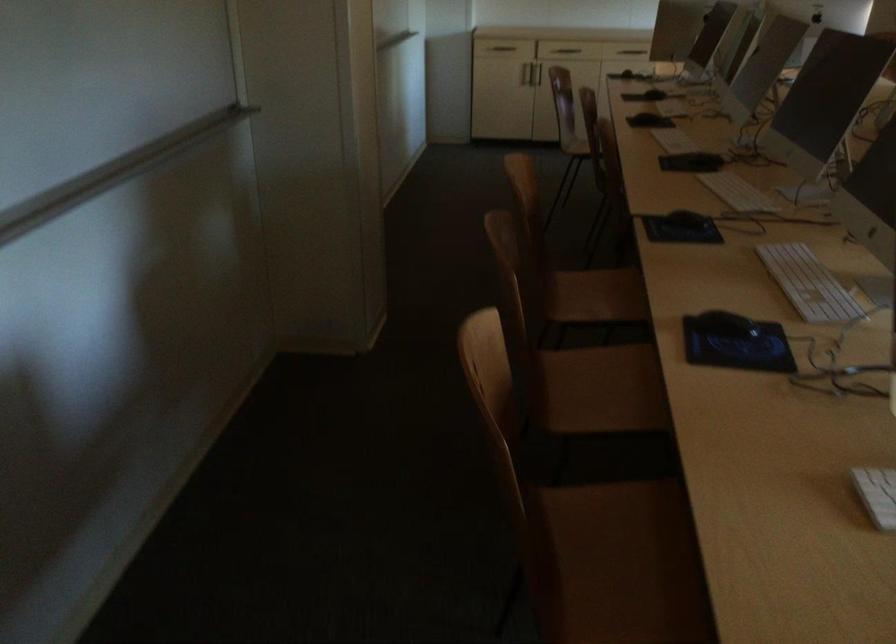
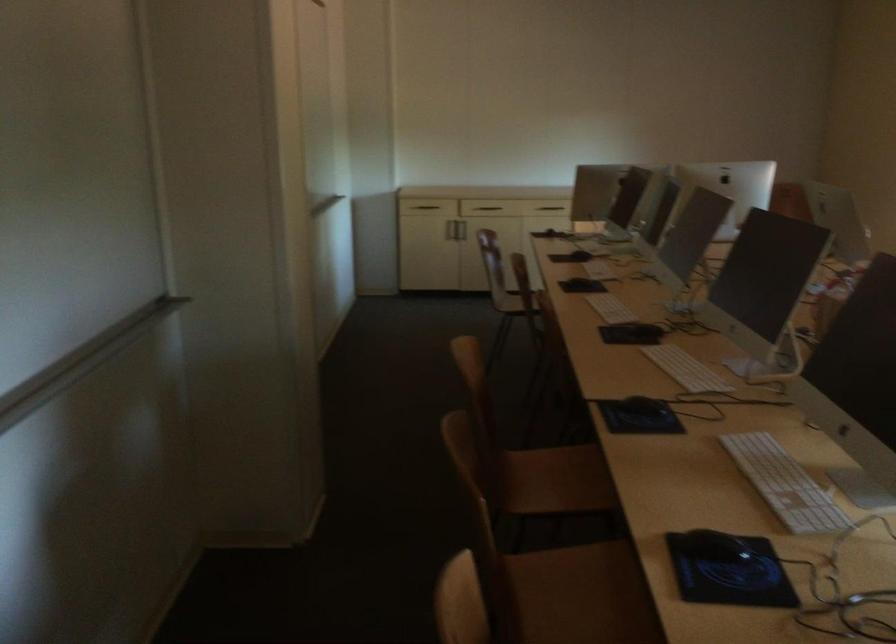
In the second image, find the point that corresponds to the point at 727,321 in the first image.

(713, 545)